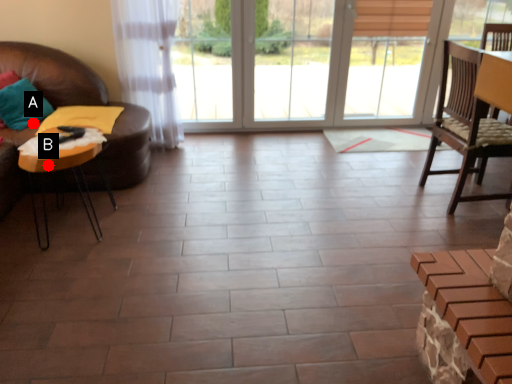
Question: Two points are circled on the image, labeled by A and B beside each circle. Which point is closer to the camera?

Choices:
 (A) A is closer
 (B) B is closer

Answer: (B)